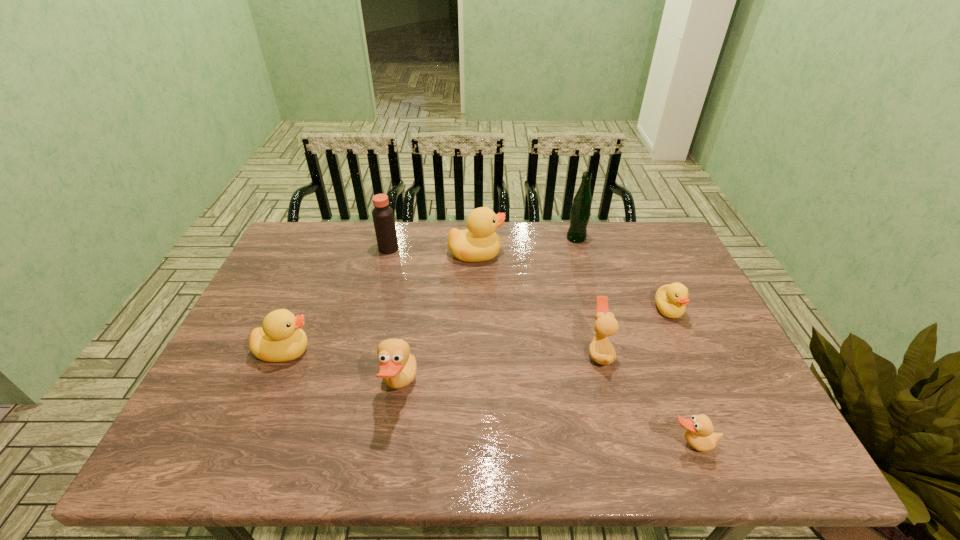
I want to click on the tallest object, so click(x=580, y=212).

You are a GUI agent. You are given a task and a screenshot of the screen. Output one action in this format:
    pyautogui.click(x=<x>, y=<y>)
    Task: Click on the green beer bottle
    The image size is (960, 540).
    Given the screenshot: What is the action you would take?
    pyautogui.click(x=580, y=212)

At what (x,y) coordinates should I click in order to perform the action: click on the seventh object from right to left. Please return your answer as a coordinate pair (x, y). Image resolution: width=960 pixels, height=540 pixels. Looking at the image, I should click on (383, 217).

You are a GUI agent. You are given a task and a screenshot of the screen. Output one action in this format:
    pyautogui.click(x=<x>, y=<y>)
    Task: Click on the brown vinegar
    The image size is (960, 540).
    Given the screenshot: What is the action you would take?
    pyautogui.click(x=383, y=217)

The width and height of the screenshot is (960, 540). I want to click on the third duck from left to right, so click(479, 242).

What are the coordinates of `the fifth object from right to left` in the screenshot? It's located at (479, 242).

You are a GUI agent. You are given a task and a screenshot of the screen. Output one action in this format:
    pyautogui.click(x=<x>, y=<y>)
    Task: Click on the leftmost tan duck
    
    Given the screenshot: What is the action you would take?
    pyautogui.click(x=398, y=368)

At what (x,y) coordinates should I click in order to perform the action: click on the biggest tan duck. Please return your answer as a coordinate pair (x, y). Looking at the image, I should click on (398, 368).

You are a GUI agent. You are given a task and a screenshot of the screen. Output one action in this format:
    pyautogui.click(x=<x>, y=<y>)
    Task: Click on the second biggest yellow duck
    The width and height of the screenshot is (960, 540).
    Given the screenshot: What is the action you would take?
    pyautogui.click(x=280, y=339)

This screenshot has width=960, height=540. I want to click on the leftmost duck, so click(280, 339).